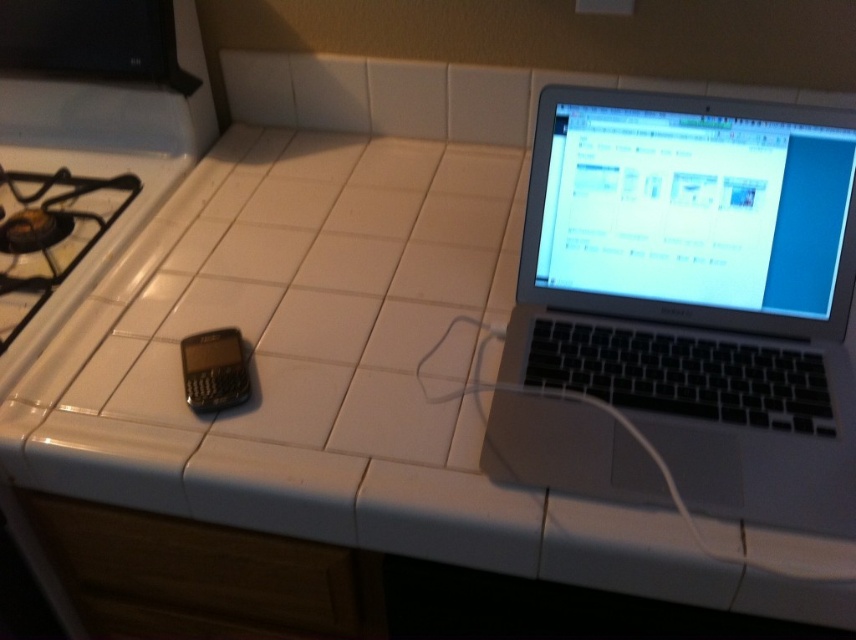
Is silver/black keyboard at right to the right of black plastic phone at lower left from the viewer's perspective?

Correct, you'll find silver/black keyboard at right to the right of black plastic phone at lower left.

The width and height of the screenshot is (856, 640). What do you see at coordinates (699, 289) in the screenshot?
I see `silver/black keyboard at right` at bounding box center [699, 289].

Between point (711, 401) and point (217, 376), which one is positioned in front?

Point (711, 401) is more forward.

Image resolution: width=856 pixels, height=640 pixels. What are the coordinates of `silver/black keyboard at right` in the screenshot? It's located at (699, 289).